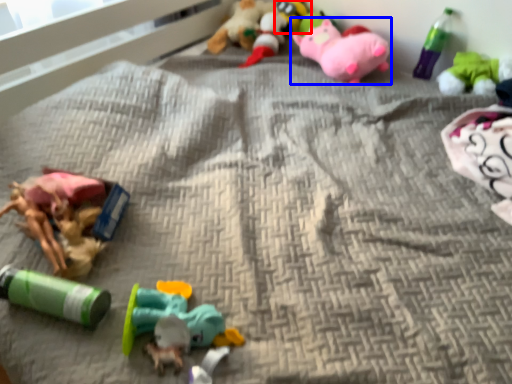
Question: Which point is closer to the camera, toy (highlighted by a red box) or toy (highlighted by a blue box)?

Choices:
 (A) toy
 (B) toy

Answer: (B)